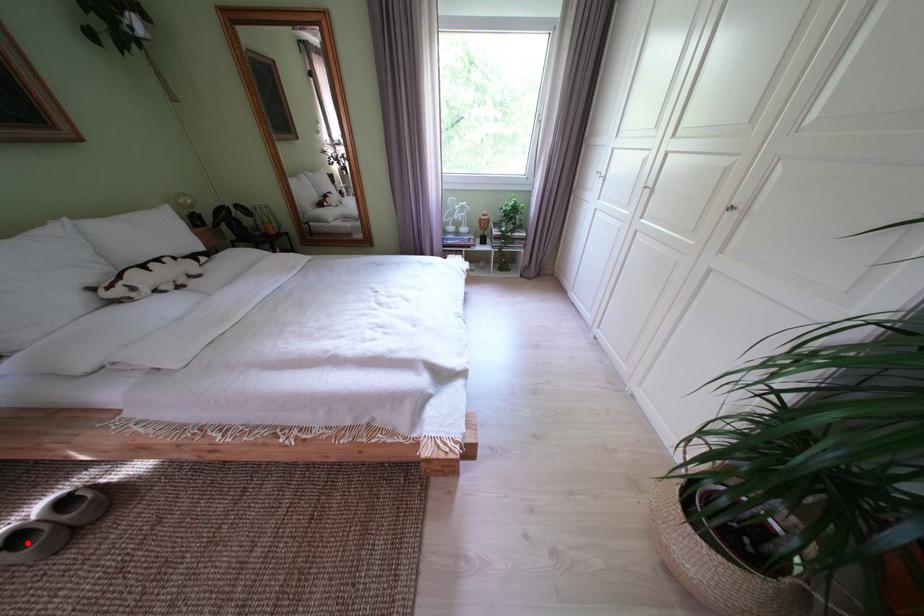
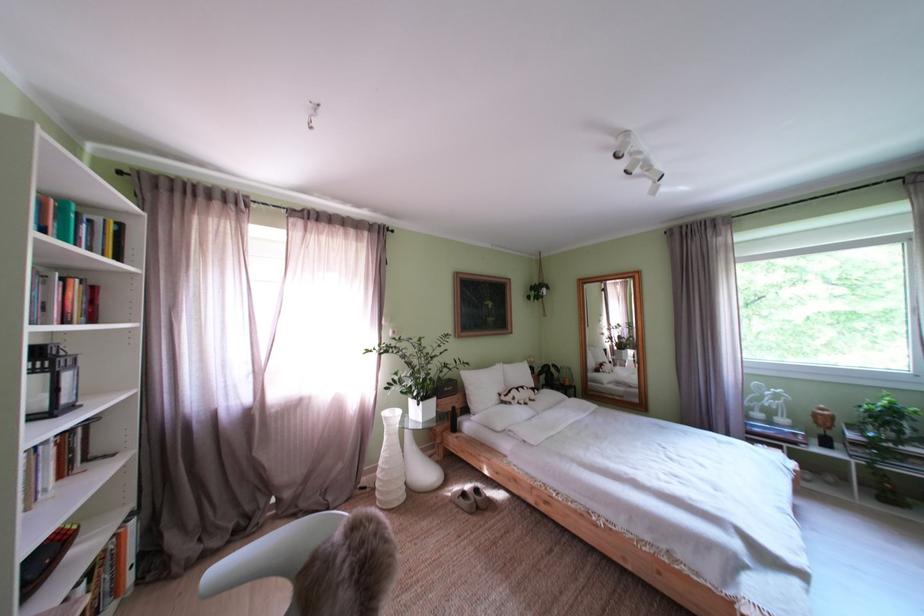
Question: I am providing you with two images of the same scene from different viewpoints. In image1, a red point is highlighted. Considering the same 3D point in image2, which of the following is correct?

Choices:
 (A) It is closer
 (B) It is farther

Answer: (B)